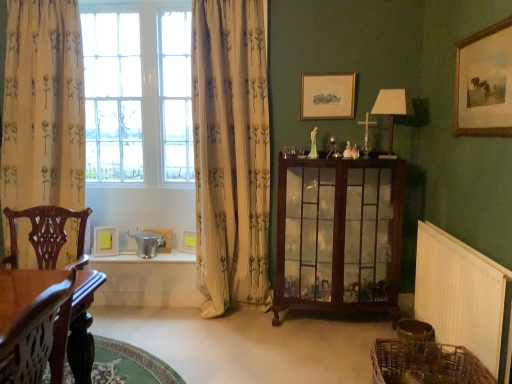
Question: Is metallic silver table at lower center to the left of white plastic radiator at lower right from the viewer's perspective?

Choices:
 (A) yes
 (B) no

Answer: (A)

Question: Is metallic silver table at lower center closer to the viewer compared to white plastic radiator at lower right?

Choices:
 (A) yes
 (B) no

Answer: (B)

Question: Considering the relative sizes of metallic silver table at lower center and white plastic radiator at lower right in the image provided, is metallic silver table at lower center wider than white plastic radiator at lower right?

Choices:
 (A) yes
 (B) no

Answer: (A)

Question: Is metallic silver table at lower center beside white plastic radiator at lower right?

Choices:
 (A) yes
 (B) no

Answer: (B)

Question: Is white plastic radiator at lower right inside metallic silver table at lower center?

Choices:
 (A) no
 (B) yes

Answer: (A)

Question: Considering the positions of metallic silver table at lower center and matte white picture frame at lower center, the second picture frame from the back, in the image, is metallic silver table at lower center wider or thinner than matte white picture frame at lower center, the second picture frame from the back,?

Choices:
 (A) wide
 (B) thin

Answer: (A)

Question: Looking at the image, does metallic silver table at lower center seem bigger or smaller compared to matte white picture frame at lower center, the second picture frame positioned from the bottom?

Choices:
 (A) small
 (B) big

Answer: (B)

Question: From the image's perspective, relative to matte white picture frame at lower center, arranged as the third picture frame when viewed from the right, is metallic silver table at lower center above or below?

Choices:
 (A) above
 (B) below

Answer: (B)

Question: From a real-world perspective, is metallic silver table at lower center physically located above or below matte white picture frame at lower center, arranged as the third picture frame when viewed from the right?

Choices:
 (A) above
 (B) below

Answer: (B)

Question: From a real-world perspective, is white glass window at upper left positioned above or below white floral fabric curtain at left, arranged as the second curtain when viewed from the right?

Choices:
 (A) above
 (B) below

Answer: (A)

Question: Considering the positions of white glass window at upper left and white floral fabric curtain at left, arranged as the second curtain when viewed from the right, in the image, is white glass window at upper left taller or shorter than white floral fabric curtain at left, arranged as the second curtain when viewed from the right,?

Choices:
 (A) short
 (B) tall

Answer: (A)

Question: Based on their sizes in the image, would you say white glass window at upper left is bigger or smaller than white floral fabric curtain at left, the 1th curtain in the left-to-right sequence?

Choices:
 (A) big
 (B) small

Answer: (B)

Question: Relative to white floral fabric curtain at left, arranged as the second curtain when viewed from the right, is white glass window at upper left in front or behind?

Choices:
 (A) front
 (B) behind

Answer: (B)

Question: Choose the correct answer: Is yellow paper at window, the 3th picture frame from the back, inside wooden framed painting at upper right, which is the first picture frame in front-to-back order, or outside it?

Choices:
 (A) outside
 (B) inside

Answer: (A)

Question: Looking at the image, does yellow paper at window, acting as the 3th picture frame starting from the bottom, seem bigger or smaller compared to wooden framed painting at upper right, the 2th picture frame from the top?

Choices:
 (A) big
 (B) small

Answer: (B)